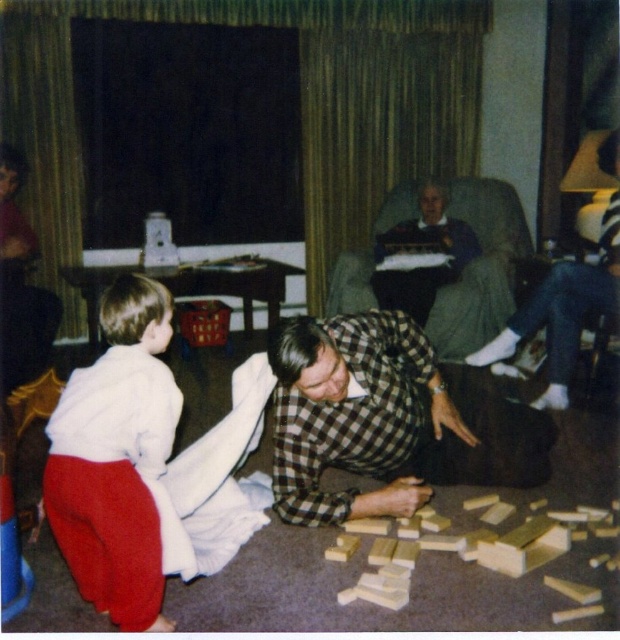
You are standing in the living room and want to place a small decorative item on the carpet near the checkered fabric shirt at center. Based on the coordinates provided, where exactly should you place it?

The checkered fabric shirt at center is located at point (x=386, y=419), so you should place the decorative item near those coordinates on the carpet.

You are looking at the scene and notice two shirts in the image. The checkered fabric shirt at center and the white cotton shirt at lower left. Which shirt is positioned to the right of the other?

The checkered fabric shirt at center is positioned to the right of the white cotton shirt at lower left.